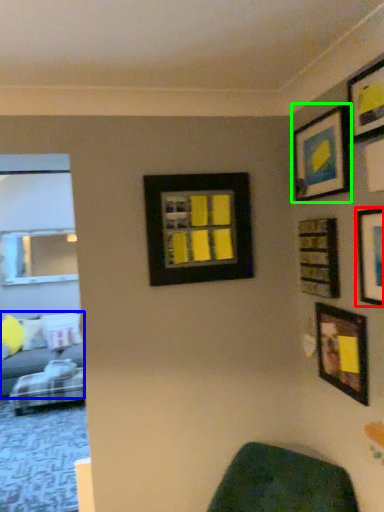
Question: Which is nearer to the picture frame (highlighted by a red box)? studio couch (highlighted by a blue box) or picture frame (highlighted by a green box).

Choices:
 (A) studio couch
 (B) picture frame

Answer: (B)